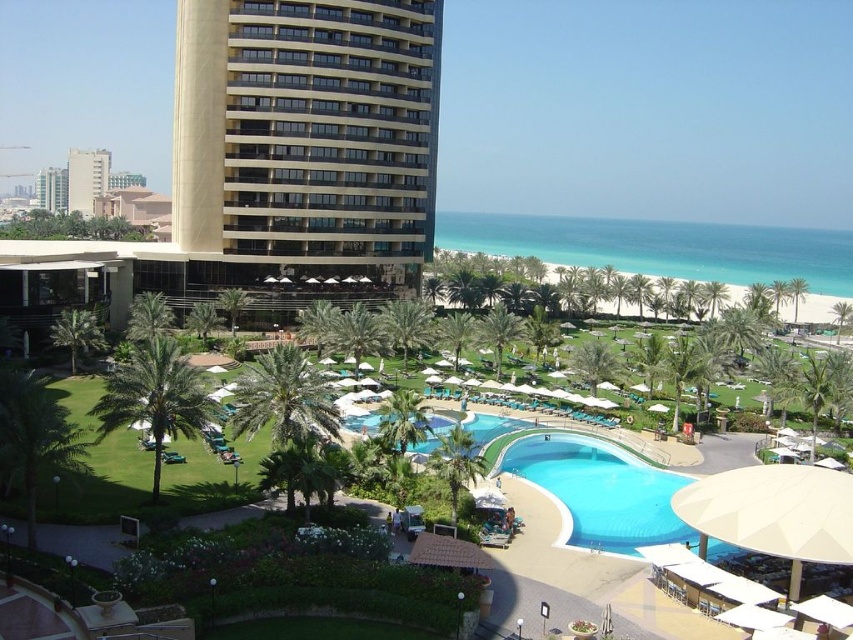
Does beige textured building at upper left have a larger size compared to blue glossy pool at center?

Yes, beige textured building at upper left is bigger than blue glossy pool at center.

Is beige textured building at upper left taller than blue glossy pool at center?

Indeed, beige textured building at upper left has a greater height compared to blue glossy pool at center.

I want to click on beige textured building at upper left, so click(x=306, y=132).